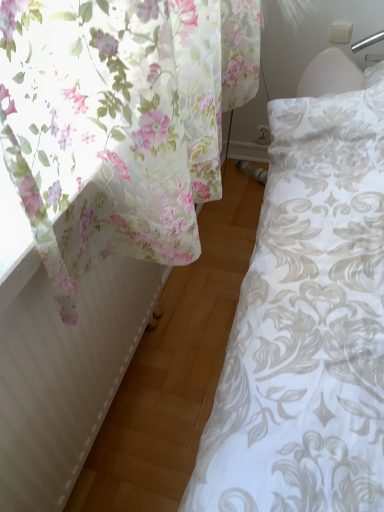
What do you see at coordinates (119, 123) in the screenshot? I see `floral fabric curtain at left` at bounding box center [119, 123].

Image resolution: width=384 pixels, height=512 pixels. I want to click on floral fabric curtain at left, so click(x=119, y=123).

Describe the element at coordinates (65, 376) in the screenshot. I see `white textured radiator at left` at that location.

You are a GUI agent. You are given a task and a screenshot of the screen. Output one action in this format:
    pyautogui.click(x=<x>, y=<y>)
    Task: Click on the white textured radiator at left
    The image size is (384, 512).
    Given the screenshot: What is the action you would take?
    pyautogui.click(x=65, y=376)

What is the approximate height of white textured radiator at left?

white textured radiator at left is 20.01 inches in height.

What is the approximate width of white textured radiator at left?

The width of white textured radiator at left is 1.40 inches.

Identify the location of floral fabric curtain at left. Image resolution: width=384 pixels, height=512 pixels. (119, 123).

Considering the positions of objects floral fabric curtain at left and white textured radiator at left in the image provided, who is more to the left, floral fabric curtain at left or white textured radiator at left?

floral fabric curtain at left.

Is floral fabric curtain at left closer to camera compared to white textured radiator at left?

No, it is behind white textured radiator at left.

Which is farther from the camera, (182, 164) or (6, 344)?

The point (6, 344) is farther.

From the image's perspective, is floral fabric curtain at left located above or below white textured radiator at left?

floral fabric curtain at left is above white textured radiator at left.

From a real-world perspective, which is physically below, floral fabric curtain at left or white textured radiator at left?

white textured radiator at left.

Looking at their sizes, would you say floral fabric curtain at left is wider or thinner than white textured radiator at left?

Clearly, floral fabric curtain at left has more width compared to white textured radiator at left.

Considering the relative sizes of floral fabric curtain at left and white textured radiator at left in the image provided, is floral fabric curtain at left taller than white textured radiator at left?

In fact, floral fabric curtain at left may be shorter than white textured radiator at left.

Is floral fabric curtain at left bigger or smaller than white textured radiator at left?

In the image, floral fabric curtain at left appears to be larger than white textured radiator at left.

Is floral fabric curtain at left completely or partially outside of white textured radiator at left?

That's correct, floral fabric curtain at left is outside of white textured radiator at left.

Based on the photo, does floral fabric curtain at left touch white textured radiator at left?

No, floral fabric curtain at left is not in contact with white textured radiator at left.

Is white textured radiator at left at the back of floral fabric curtain at left?

No, floral fabric curtain at left is not facing away from white textured radiator at left.

Can you tell me how much floral fabric curtain at left and white textured radiator at left differ in facing direction?

0.857 degrees.

You are a GUI agent. You are given a task and a screenshot of the screen. Output one action in this format:
    pyautogui.click(x=<x>, y=<y>)
    Task: Click on the radiator below the floral fabric curtain at left (from the image's perspective)
    
    Given the screenshot: What is the action you would take?
    pyautogui.click(x=65, y=376)

Based on their positions, is white textured radiator at left located to the left or right of floral fabric curtain at left?

white textured radiator at left is to the right of floral fabric curtain at left.

Considering the relative positions of white textured radiator at left and floral fabric curtain at left in the image provided, is white textured radiator at left in front of floral fabric curtain at left?

Yes, white textured radiator at left is in front of floral fabric curtain at left.

Between point (98, 333) and point (68, 223), which one is positioned behind?

The point (98, 333) is more distant.

From the image's perspective, which is above, white textured radiator at left or floral fabric curtain at left?

floral fabric curtain at left is shown above in the image.

Based on the photo, from a real-world perspective, is white textured radiator at left positioned under floral fabric curtain at left based on gravity?

Indeed, from a real-world perspective, white textured radiator at left is positioned beneath floral fabric curtain at left.

Considering the sizes of white textured radiator at left and floral fabric curtain at left in the image, is white textured radiator at left wider or thinner than floral fabric curtain at left?

white textured radiator at left is thinner than floral fabric curtain at left.

Does white textured radiator at left have a greater height compared to floral fabric curtain at left?

Indeed, white textured radiator at left has a greater height compared to floral fabric curtain at left.

Can you confirm if white textured radiator at left is smaller than floral fabric curtain at left?

Correct, white textured radiator at left occupies less space than floral fabric curtain at left.

Is white textured radiator at left inside the boundaries of floral fabric curtain at left, or outside?

white textured radiator at left exists outside the volume of floral fabric curtain at left.

Are white textured radiator at left and floral fabric curtain at left making contact?

No, white textured radiator at left is not making contact with floral fabric curtain at left.

Does white textured radiator at left turn towards floral fabric curtain at left?

No.

Based on the photo, how different are the orientations of white textured radiator at left and floral fabric curtain at left in degrees?

The angular difference between white textured radiator at left and floral fabric curtain at left is 0.857 degrees.

You are a GUI agent. You are given a task and a screenshot of the screen. Output one action in this format:
    pyautogui.click(x=<x>, y=<y>)
    Task: Click on the curtain above the white textured radiator at left (from a real-world perspective)
    This screenshot has width=384, height=512.
    Given the screenshot: What is the action you would take?
    pyautogui.click(x=119, y=123)

The width and height of the screenshot is (384, 512). Identify the location of radiator lying below the floral fabric curtain at left (from the image's perspective). pyautogui.click(x=65, y=376).

The height and width of the screenshot is (512, 384). In order to click on curtain that is behind the white textured radiator at left in this screenshot , I will do `click(119, 123)`.